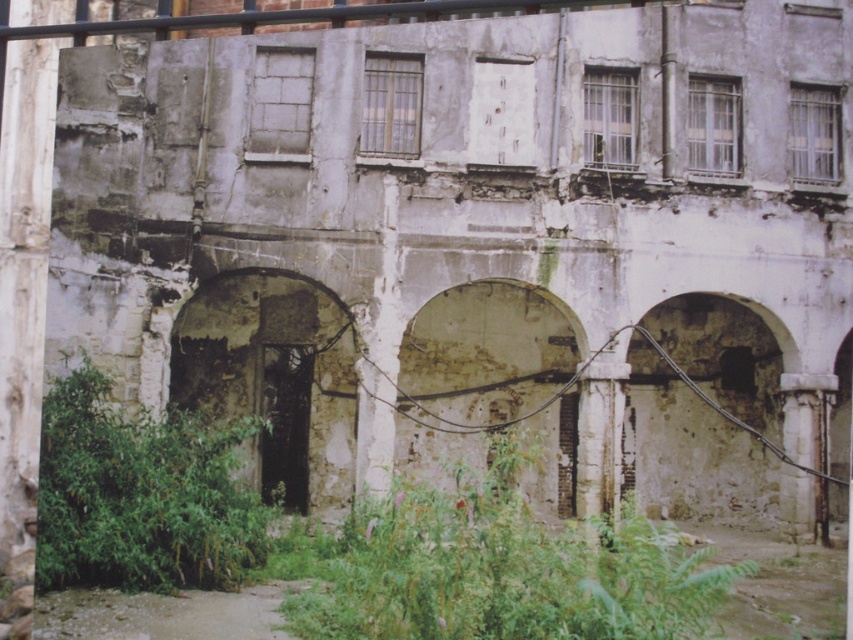
You are a botanist examining the old building. You notice green leafy plants at center growing through cracks in the building. Based on their position, which part of the building are they most likely growing from?

The green leafy plants at center are positioned at point (503, 570), which corresponds to the upper part of the building. Since the upper part shows signs of neglect with boarded up areas, the plants are likely growing from cracks in the upper part of the building.

You are standing in front of the old dilapidated building and want to know the exact position of the green leafy plants at center. Can you tell me where they are located in terms of coordinates?

The green leafy plants at center are located at coordinates point (503, 570).

You are a botanist examining the green leafy plants at center and the rusty stone archway at center left in the scene. Which object occupies more space in the image?

The green leafy plants at center has a larger size compared to the rusty stone archway at center left, so it occupies more space in the image.